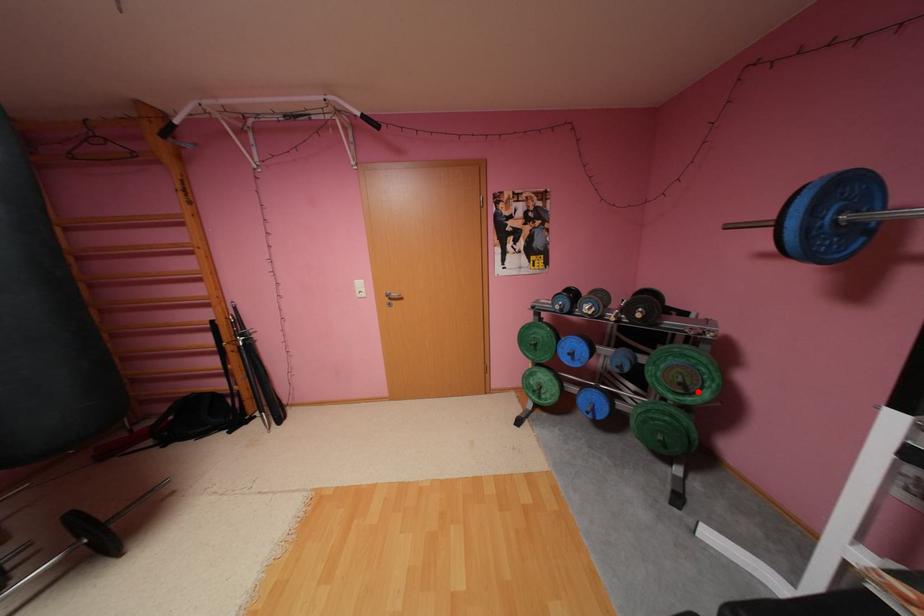
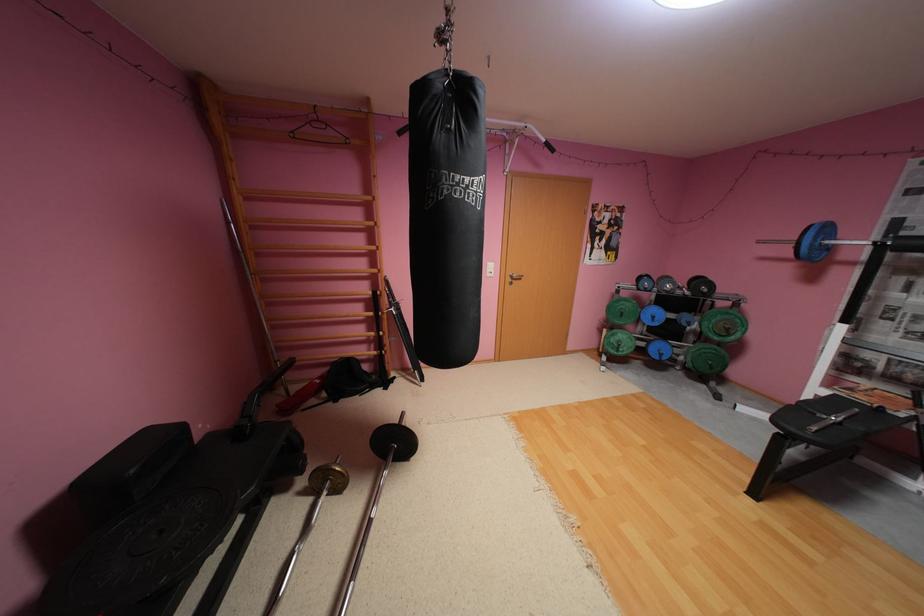
Question: I am providing you with two images of the same scene from different viewpoints. Image1 has a red point marked. In image2, the corresponding 3D location appears at what relative position? Reply with the corresponding letter.

Choices:
 (A) Closer
 (B) Farther

Answer: (A)